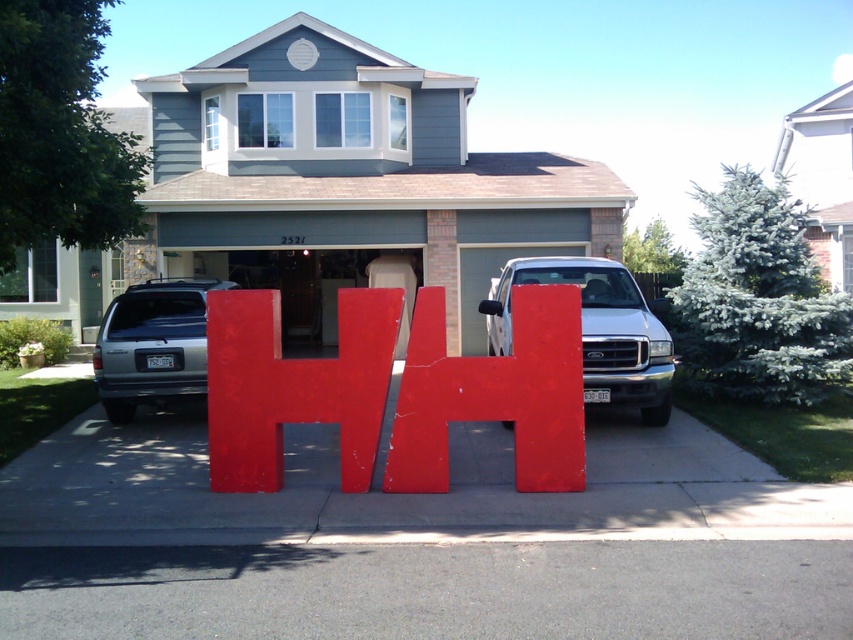
Question: Based on their relative distances, which object is farther from the red matte letter h at center?

Choices:
 (A) silver metallic suv at center
 (B) smooth concrete driveway at center
 (C) gray asphalt at center

Answer: (A)

Question: Considering the relative positions of gray siding garage at center and gray asphalt at center in the image provided, where is gray siding garage at center located with respect to gray asphalt at center?

Choices:
 (A) above
 (B) below

Answer: (A)

Question: Is red matte letter h at center further to camera compared to silver metallic suv at center?

Choices:
 (A) yes
 (B) no

Answer: (B)

Question: Among these points, which one is farthest from the camera?

Choices:
 (A) (233, 340)
 (B) (189, 282)
 (C) (548, 220)
 (D) (97, 465)

Answer: (C)

Question: Considering the real-world distances, which object is closest to the smooth concrete driveway at center?

Choices:
 (A) white glossy truck at center
 (B) silver metallic suv at center
 (C) gray siding garage at center
 (D) gray asphalt at center

Answer: (A)

Question: Is gray siding garage at center to the right of gray asphalt at center from the viewer's perspective?

Choices:
 (A) no
 (B) yes

Answer: (A)